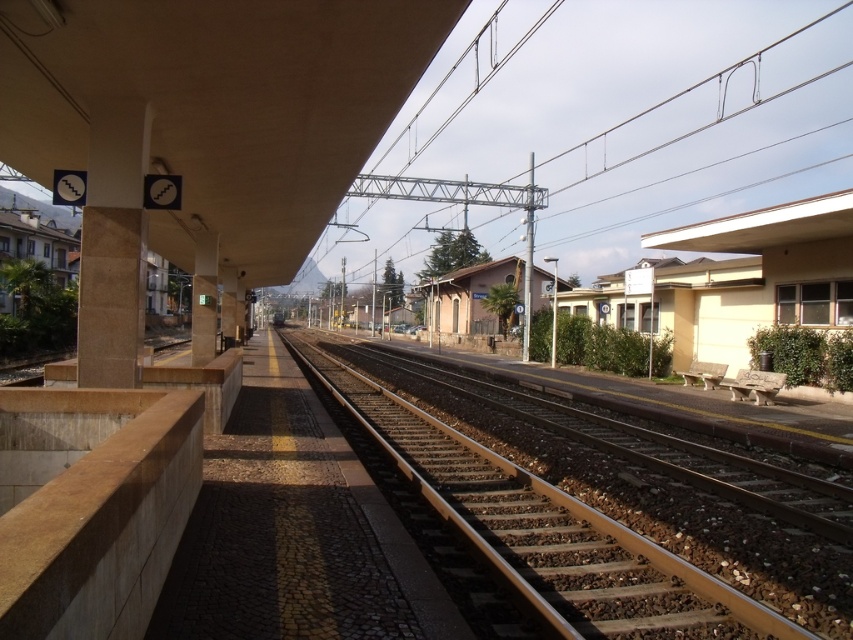
You are a pedestrian on the platform and want to walk from the beige stone pillar at upper left to the brown gravel track at center. Which direction should you move to reach the track?

The brown gravel track at center is positioned on the right side of beige stone pillar at upper left, so you should move to your right to reach the track.

From the picture: You are standing on the platform and want to take a photo of the brown gravel track at center and the beige stone pillar at upper left. Which object should you focus on first to ensure both are in the frame?

You should focus on the brown gravel track at center first because it is closer to the viewer than the beige stone pillar at upper left, ensuring both are in the frame.

You are standing on the platform at the railway station and see two points marked on the ground. The first point is at coordinate point (810, 618) and the second point is at coordinate point (125, 349). If you are facing the direction of the tracks, which point is closer to you?

Point (810, 618) is in front of point (125, 349), so the first point is closer to you.